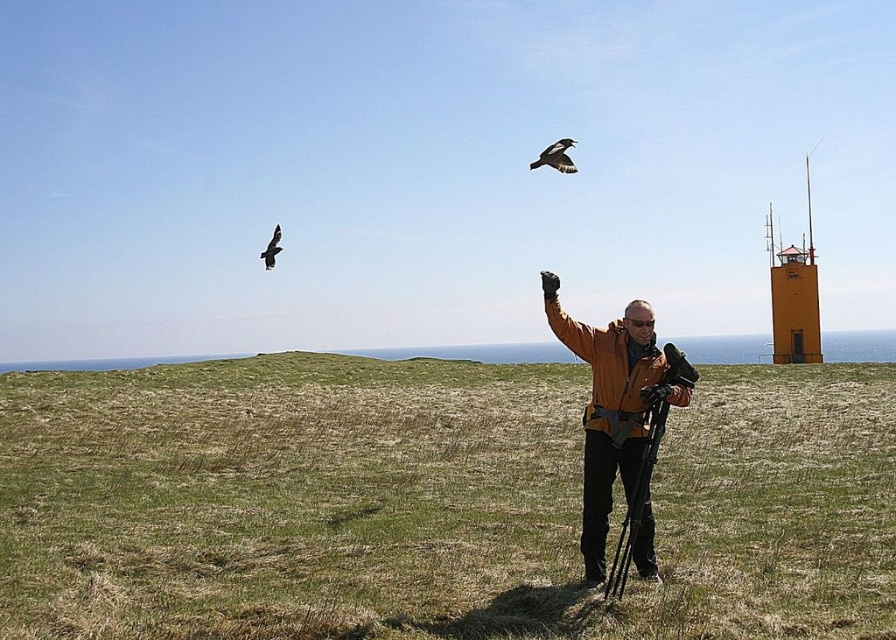
Question: Can you confirm if yellow painted metal tower at right is positioned below black plastic tripod at center?

Choices:
 (A) yes
 (B) no

Answer: (B)

Question: Which point appears closest to the camera in this image?

Choices:
 (A) (592, 570)
 (B) (808, 236)
 (C) (557, 166)

Answer: (A)

Question: Is orange softshell jacket at center bigger than black glossy bird at upper center?

Choices:
 (A) yes
 (B) no

Answer: (A)

Question: Among these points, which one is farthest from the camera?

Choices:
 (A) (668, 456)
 (B) (643, 388)
 (C) (277, 243)

Answer: (C)

Question: Can you confirm if orange softshell jacket at center is positioned above yellow painted metal tower at right?

Choices:
 (A) yes
 (B) no

Answer: (B)

Question: Which object is the farthest from the yellow painted metal tower at right?

Choices:
 (A) black glossy bird at upper center
 (B) green grassy field at center

Answer: (A)